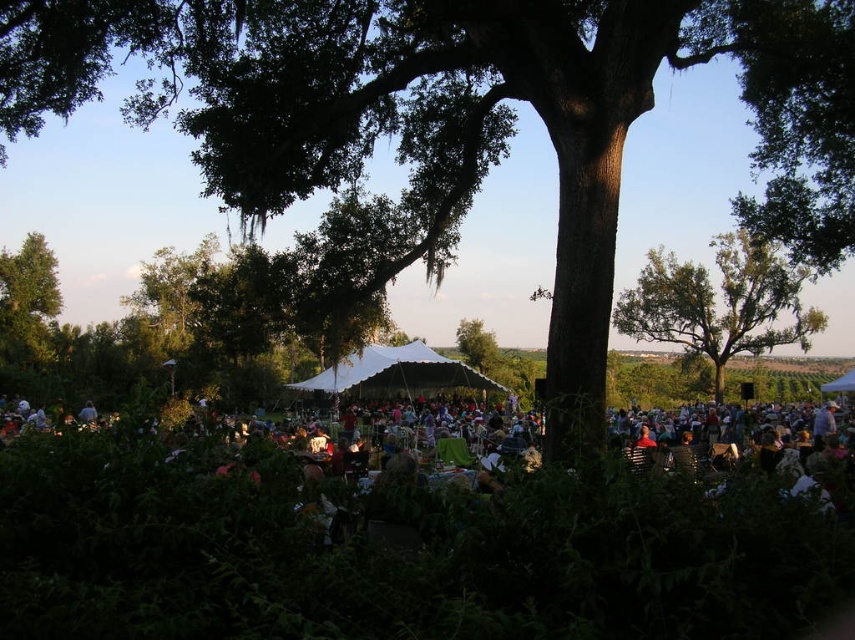
Is the position of green leafy tree at upper center more distant than that of white fabric canopy at center?

That is True.

Consider the image. Who is more distant from viewer, (699, 349) or (394, 355)?

Point (699, 349)

What are the coordinates of `green leafy tree at upper center` in the screenshot? It's located at (718, 301).

The width and height of the screenshot is (855, 640). What do you see at coordinates (396, 372) in the screenshot? I see `white fabric canopy at center` at bounding box center [396, 372].

From the picture: Is white fabric canopy at center below green leafy tree at center?

Result: No, white fabric canopy at center is not below green leafy tree at center.

Between point (422, 365) and point (496, 355), which one is positioned in front?

Point (422, 365) is more forward.

Find the location of a particular element. Image resolution: width=855 pixels, height=640 pixels. white fabric canopy at center is located at coordinates (396, 372).

Who is more forward, (x=744, y=305) or (x=52, y=307)?

Point (x=744, y=305)

Who is positioned more to the right, green leafy tree at upper center or green leafy tree at left?

From the viewer's perspective, green leafy tree at upper center appears more on the right side.

You are a GUI agent. You are given a task and a screenshot of the screen. Output one action in this format:
    pyautogui.click(x=<x>, y=<y>)
    Task: Click on the green leafy tree at upper center
    
    Given the screenshot: What is the action you would take?
    pyautogui.click(x=718, y=301)